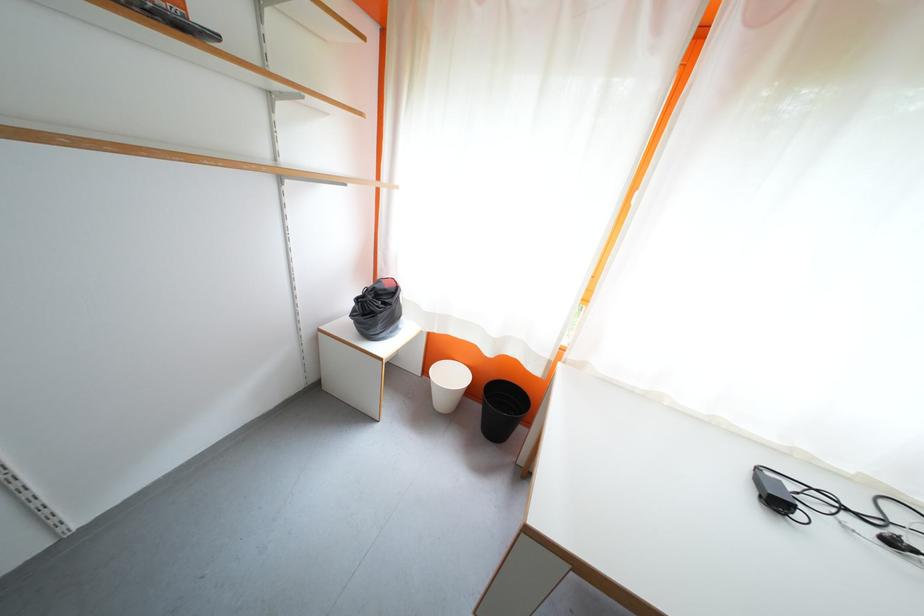
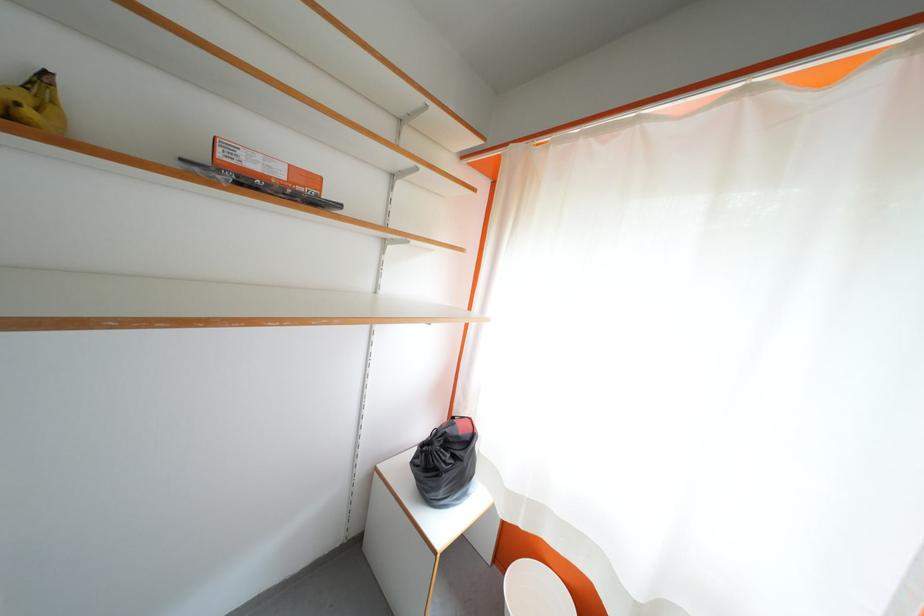
In the second image, find the point that corresponds to the point at 386,310 in the first image.

(455, 460)